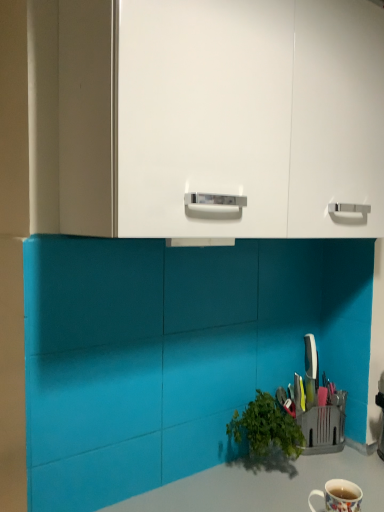
Question: Can you confirm if white glossy mug at lower right is bigger than white glossy cabinet at upper center?

Choices:
 (A) yes
 (B) no

Answer: (B)

Question: Does white glossy mug at lower right lie behind white glossy cabinet at upper center?

Choices:
 (A) no
 (B) yes

Answer: (B)

Question: Would you say white glossy mug at lower right contains white glossy cabinet at upper center?

Choices:
 (A) no
 (B) yes

Answer: (A)

Question: Is white glossy mug at lower right not near white glossy cabinet at upper center?

Choices:
 (A) no
 (B) yes

Answer: (A)

Question: From the image's perspective, does white glossy mug at lower right appear lower than white glossy cabinet at upper center?

Choices:
 (A) yes
 (B) no

Answer: (A)

Question: Considering the relative sizes of white glossy mug at lower right and white glossy cabinet at upper center in the image provided, is white glossy mug at lower right shorter than white glossy cabinet at upper center?

Choices:
 (A) yes
 (B) no

Answer: (A)

Question: Is smooth gray countertop at lower center directly adjacent to white glossy cabinet at upper center?

Choices:
 (A) no
 (B) yes

Answer: (A)

Question: From a real-world perspective, is smooth gray countertop at lower center below white glossy cabinet at upper center?

Choices:
 (A) yes
 (B) no

Answer: (A)

Question: Is smooth gray countertop at lower center positioned behind white glossy cabinet at upper center?

Choices:
 (A) no
 (B) yes

Answer: (B)

Question: Can you confirm if smooth gray countertop at lower center is thinner than white glossy cabinet at upper center?

Choices:
 (A) no
 (B) yes

Answer: (A)

Question: From the image's perspective, is smooth gray countertop at lower center beneath white glossy cabinet at upper center?

Choices:
 (A) no
 (B) yes

Answer: (B)

Question: Does smooth gray countertop at lower center have a smaller size compared to white glossy cabinet at upper center?

Choices:
 (A) no
 (B) yes

Answer: (A)

Question: Is white glossy mug at lower right next to smooth gray countertop at lower center?

Choices:
 (A) yes
 (B) no

Answer: (B)